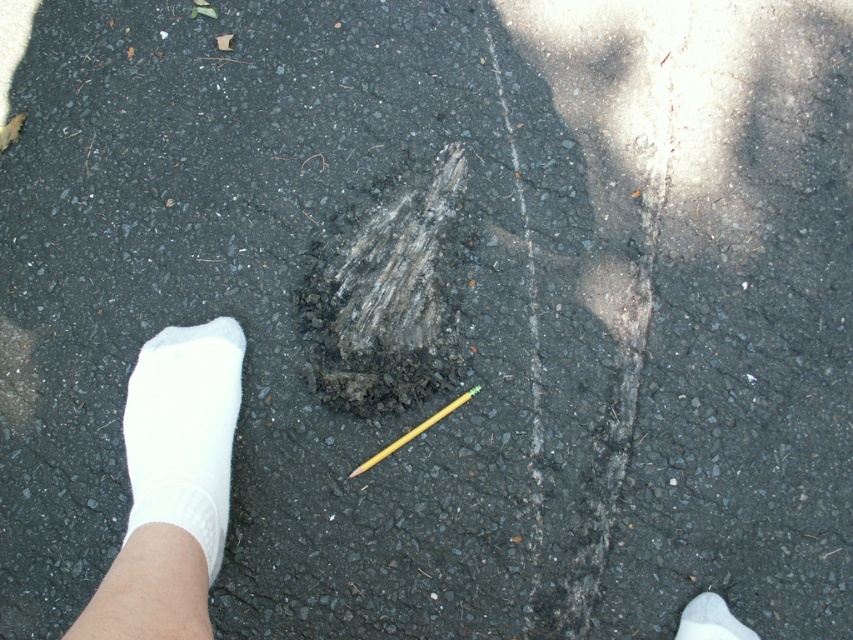
Between point (186, 416) and point (354, 474), which one is positioned behind?

Positioned behind is point (354, 474).

Is white cotton sock at lower left positioned at the back of yellow wood pencil at center?

No, it is not.

Identify the location of white cotton sock at lower left. (184, 429).

Is white sock at lower left bigger than white cotton sock at lower left?

Yes, white sock at lower left is bigger than white cotton sock at lower left.

Is point (178, 424) positioned before point (218, 420)?

Yes.

At what (x,y) coordinates should I click in order to perform the action: click on white sock at lower left. Please return your answer as a coordinate pair (x, y). Image resolution: width=853 pixels, height=640 pixels. Looking at the image, I should click on (173, 484).

Is point (180, 364) behind point (363, 468)?

No, it is not.

Can you confirm if white sock at lower left is positioned below yellow wood pencil at center?

Indeed, white sock at lower left is positioned under yellow wood pencil at center.

What do you see at coordinates (173, 484) in the screenshot?
I see `white sock at lower left` at bounding box center [173, 484].

The height and width of the screenshot is (640, 853). I want to click on white sock at lower left, so click(x=173, y=484).